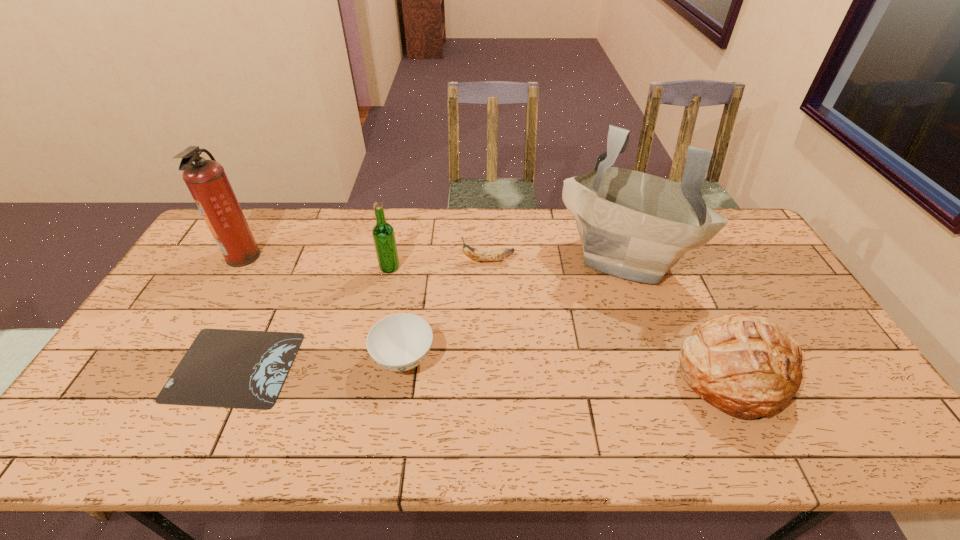
You are a GUI agent. You are given a task and a screenshot of the screen. Output one action in this format:
    pyautogui.click(x=<x>, y=<y>)
    Task: Click on the vacant space positioned on the back of the fourth tallest object
    This screenshot has width=960, height=540.
    Given the screenshot: What is the action you would take?
    pyautogui.click(x=688, y=274)

Identify the location of vacant space located at the stem of the banana. Image resolution: width=960 pixels, height=540 pixels. (354, 260).

The width and height of the screenshot is (960, 540). I want to click on blank space located at the stem of the banana, so click(x=434, y=260).

Find the location of a particular element. The image size is (960, 540). free space located 0.370m at the stem of the banana is located at coordinates (348, 260).

At what (x,y) coordinates should I click in order to perform the action: click on free region located 0.170m on the left of the chinaware. Please return your answer as a coordinate pair (x, y). Looking at the image, I should click on (308, 358).

Where is `vacant space situated on the right of the shortest object`? vacant space situated on the right of the shortest object is located at coordinates (371, 366).

What are the coordinates of `shopping bag at the far edge` in the screenshot? It's located at (632, 225).

What are the coordinates of `fire extinguisher present at the far edge` in the screenshot? It's located at 206,180.

The height and width of the screenshot is (540, 960). Identify the location of object present at the near edge. (740, 363).

Where is `fire extinguisher that is at the left edge`? fire extinguisher that is at the left edge is located at coordinates (206, 180).